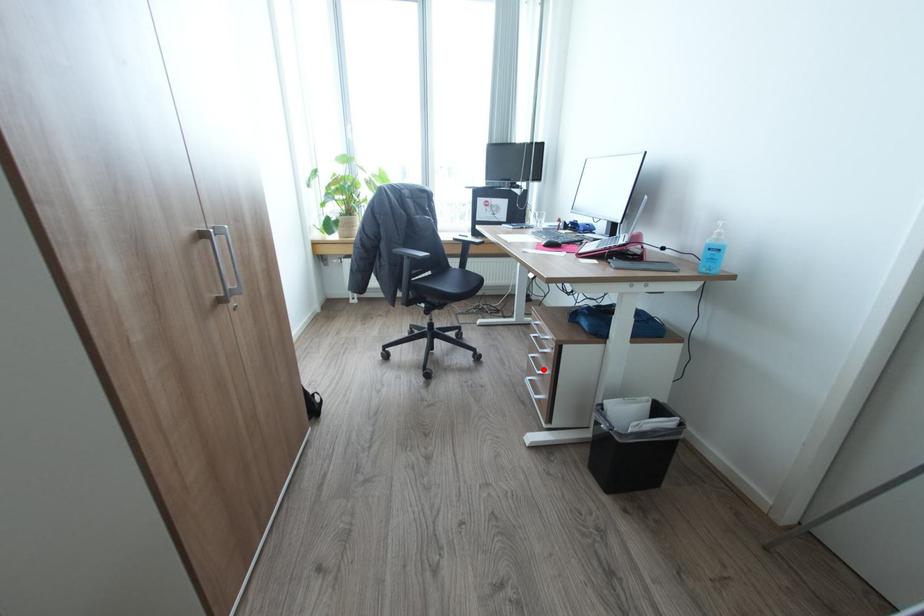
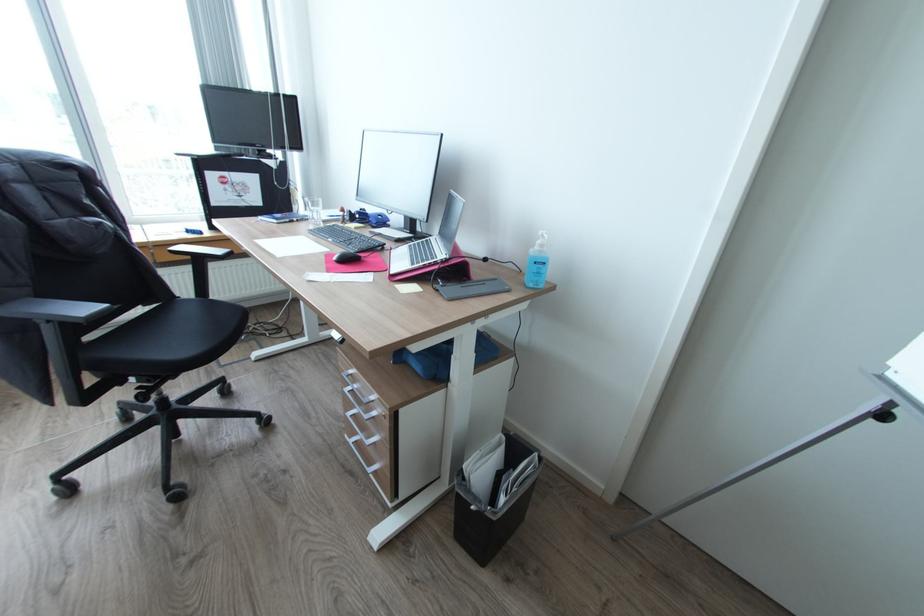
Question: I am providing you with two images of the same scene from different viewpoints. Given a red point in image1, look at the same physical point in image2. Is it:

Choices:
 (A) Closer to the viewpoint
 (B) Farther from the viewpoint

Answer: (B)